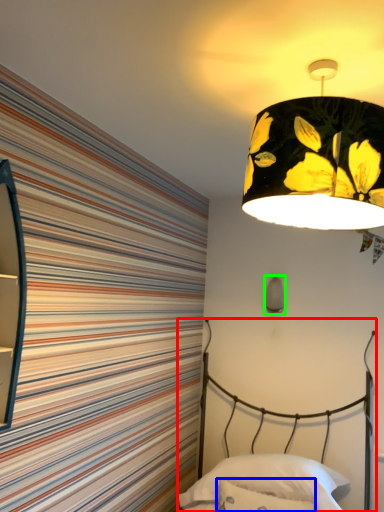
Question: Estimate the real-world distances between objects in this image. Which object is closer to bed (highlighted by a red box), throw pillow (highlighted by a blue box) or lamp (highlighted by a green box)?

Choices:
 (A) throw pillow
 (B) lamp

Answer: (A)